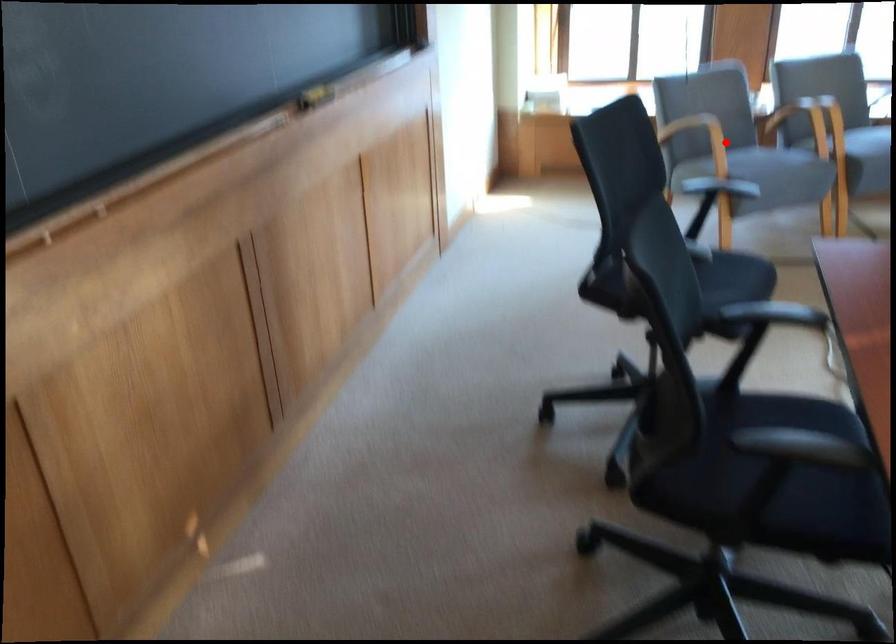
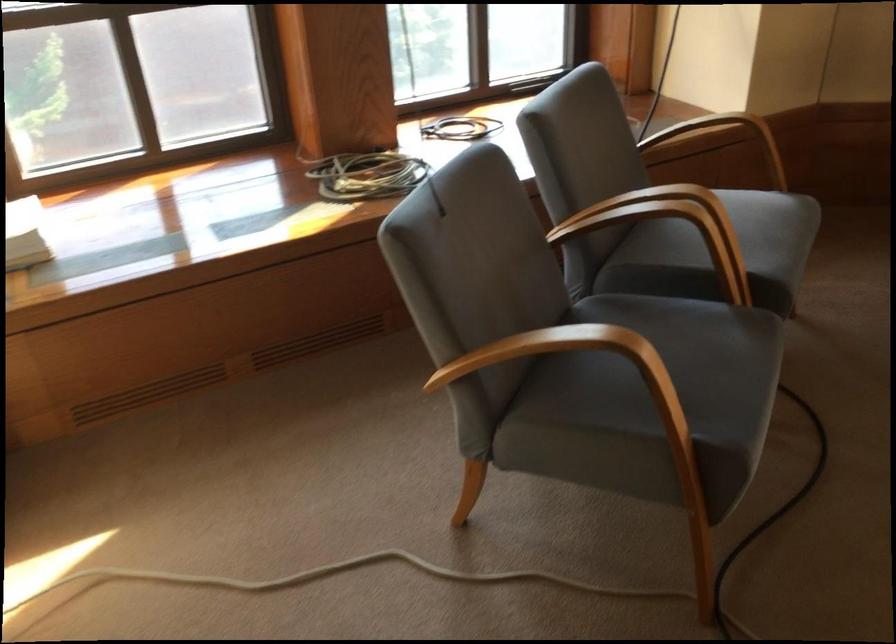
Find the pixel in the second image that matches the highlighted location in the first image.

(591, 375)